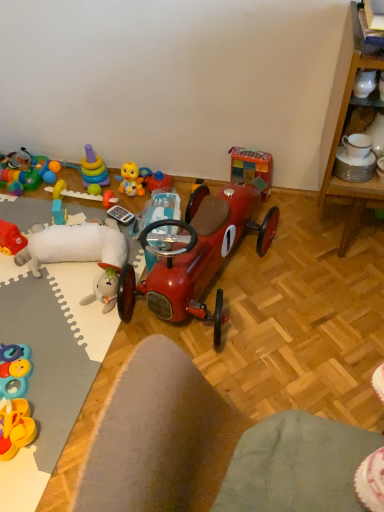
What are the coordinates of `unoccupied region to the right of wooden block tower at upper right, the first toy in the right-to-left sequence` in the screenshot? It's located at (293, 204).